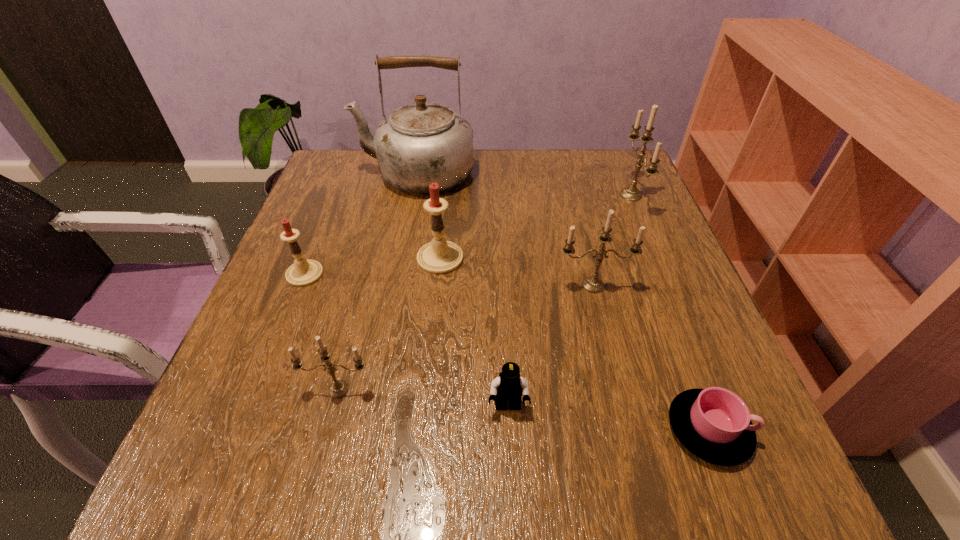
Identify the location of kettle. This screenshot has height=540, width=960. (421, 143).

Where is `the tallest candle`? The width and height of the screenshot is (960, 540). the tallest candle is located at coordinates (631, 193).

Find the location of a particular element. The width and height of the screenshot is (960, 540). the second tallest object is located at coordinates (631, 193).

Find the location of `the third candle from right to left`. the third candle from right to left is located at coordinates (439, 256).

What are the coordinates of `the bigger red candle` in the screenshot? It's located at (439, 256).

This screenshot has height=540, width=960. I want to click on the second smallest metallic candle, so click(x=592, y=284).

The height and width of the screenshot is (540, 960). In order to click on the fourth candle from left to right in this screenshot , I will do `click(592, 284)`.

This screenshot has height=540, width=960. I want to click on the smaller red candle, so click(x=303, y=272).

The height and width of the screenshot is (540, 960). In order to click on the leftmost candle in this screenshot , I will do `click(303, 272)`.

The width and height of the screenshot is (960, 540). I want to click on the nearest candle, so click(x=339, y=388).